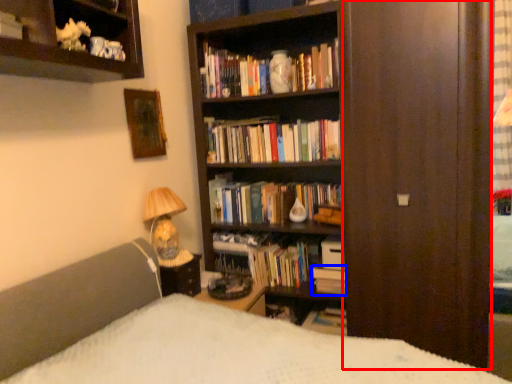
Question: Which of the following is the closest to the observer, screen door (highlighted by a red box) or book (highlighted by a blue box)?

Choices:
 (A) screen door
 (B) book

Answer: (A)